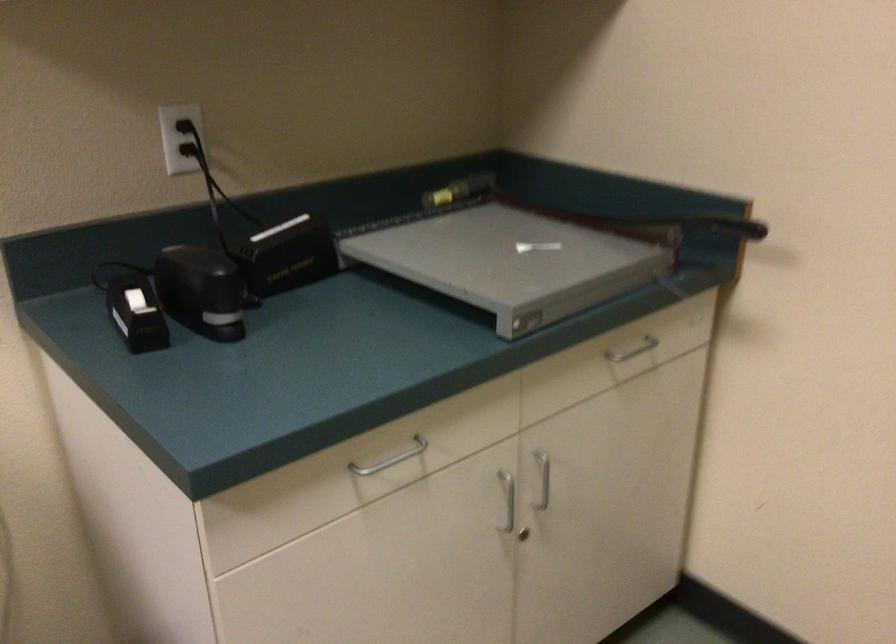
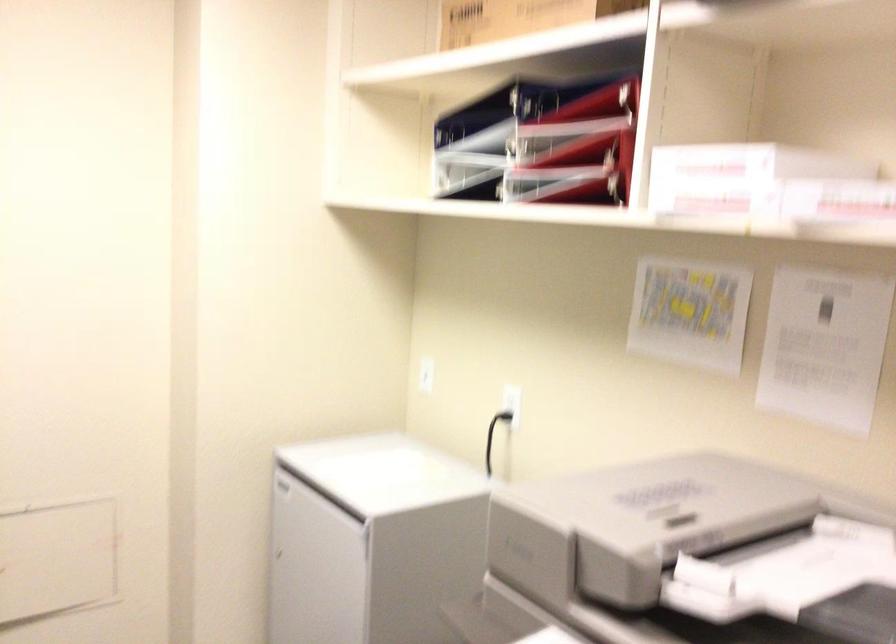
Question: The camera is either moving clockwise (left) or counter-clockwise (right) around the object. The first image is from the beginning of the video and the second image is from the end. Is the camera moving left or right when shooting the video?

Choices:
 (A) Left
 (B) Right

Answer: (B)